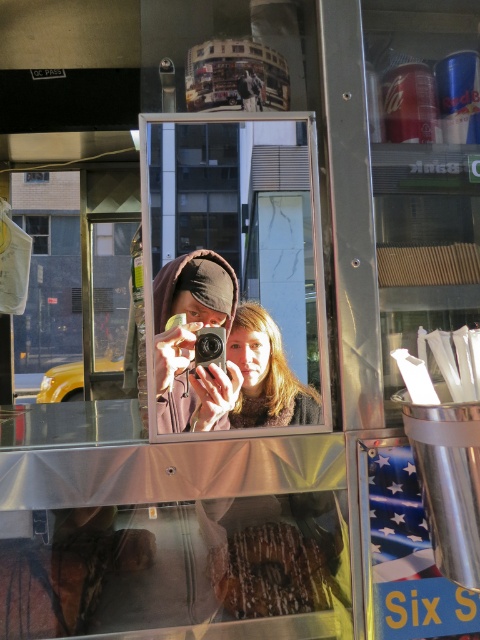
You are a photographer trying to capture the reflection in the mirror. The matte brown hair at center and the black plastic camera at center are both visible in the reflection. Which object appears bigger in the reflection?

The matte brown hair at center appears bigger in the reflection than the black plastic camera at center because it is larger in size according to the description.

You are trying to decide which item is bigger between the matte black camera at center and the matte brown hair at center. Which one is larger?

The matte black camera at center is larger than the matte brown hair at center according to the description.

You are standing at the point marked as point (172,336) in the food stand. You want to reach the exit door located behind the display case with pastries. Can you estimate how far you need to walk to reach the exit door?

The distance between you and the exit door is 4.59 feet. Therefore, you need to walk approximately 4.59 feet to reach the exit door.